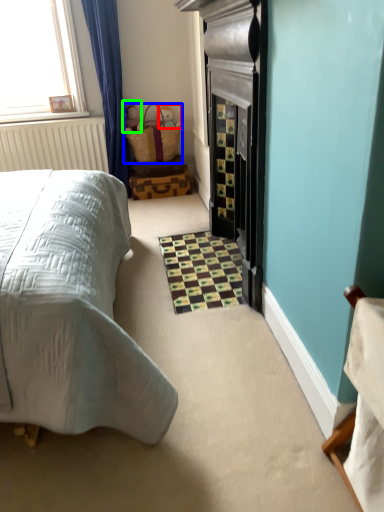
Question: Which object is the closest to the toy (highlighted by a red box)? Choose among these: basket (highlighted by a blue box) or toy (highlighted by a green box).

Choices:
 (A) basket
 (B) toy

Answer: (A)